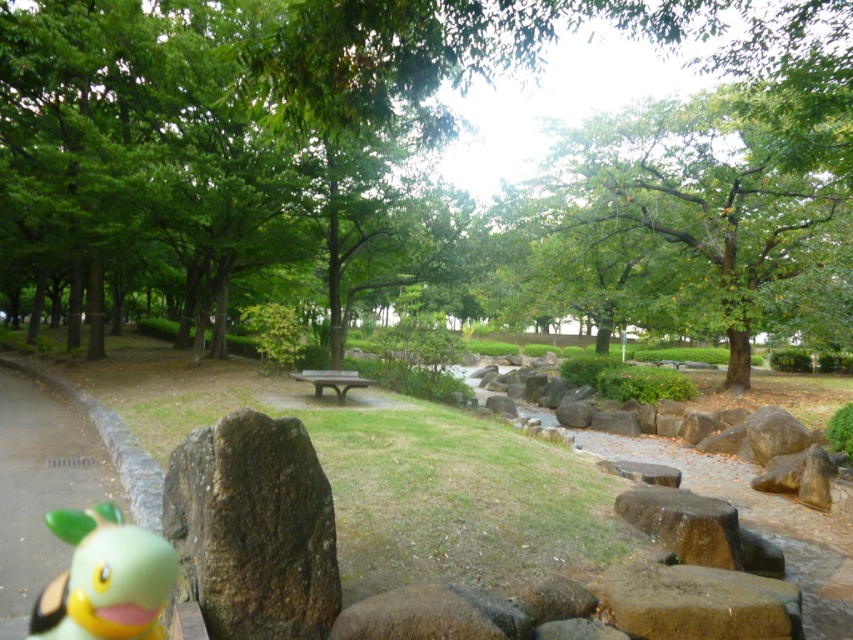
Is green rubber duck at lower left positioned behind dark brown wooden bench at center?

No, it is not.

Between green rubber duck at lower left and dark brown wooden bench at center, which one is positioned lower?

green rubber duck at lower left

Does point (144, 632) lie behind point (335, 372)?

That is False.

Find the location of a particular element. green rubber duck at lower left is located at coordinates (103, 579).

Identify the location of green leafy tree at center. The image size is (853, 640). (419, 154).

Who is shorter, green leafy tree at center or green rubber duck at lower left?

With less height is green rubber duck at lower left.

Find the location of a particular element. green leafy tree at center is located at coordinates pos(419,154).

Which is more to the left, brown rough rock at lower left or green rubber duck at lower left?

green rubber duck at lower left

Image resolution: width=853 pixels, height=640 pixels. Describe the element at coordinates (253, 529) in the screenshot. I see `brown rough rock at lower left` at that location.

This screenshot has width=853, height=640. What are the coordinates of `brown rough rock at lower left` in the screenshot? It's located at (253, 529).